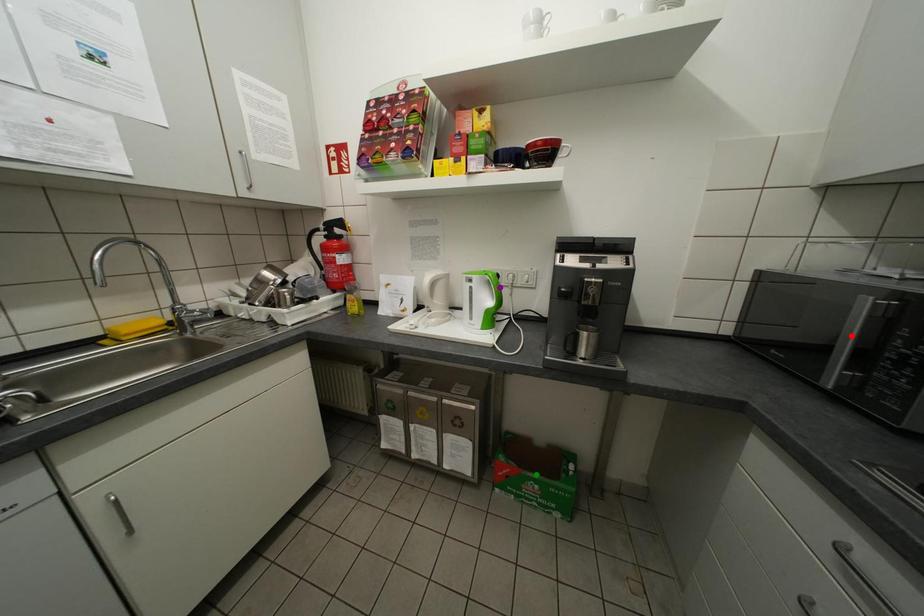
Order these from nearest to farthest:
1. purple point
2. red point
3. green point

red point < purple point < green point